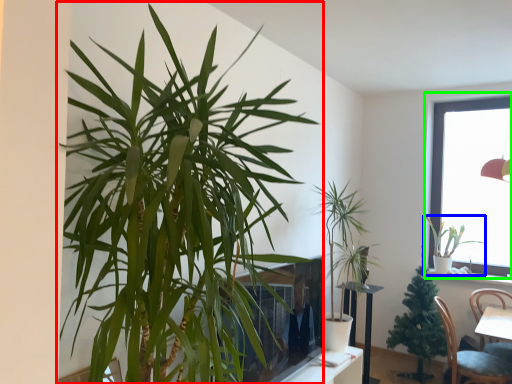
Question: Considering the real-world distances, which object is farthest from houseplant (highlighted by a red box)? houseplant (highlighted by a blue box) or window (highlighted by a green box)?

Choices:
 (A) houseplant
 (B) window

Answer: (A)